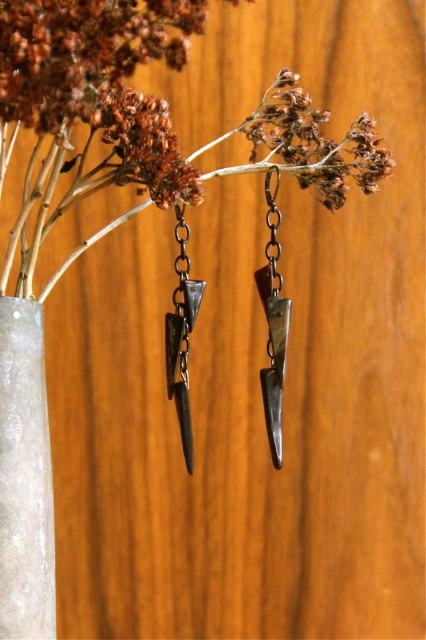
Find the location of `brown matte flower at upper center`. brown matte flower at upper center is located at coordinates (146, 145).

Is brown matte flower at upper center above matte silver earring at center?

Correct, brown matte flower at upper center is located above matte silver earring at center.

Is point (181, 198) in front of point (183, 236)?

That is True.

Find the location of a particular element. This screenshot has height=640, width=426. brown matte flower at upper center is located at coordinates (146, 145).

Does point (161, 157) come closer to viewer compared to point (275, 236)?

Yes.

Does brown matte flower at upper center have a larger size compared to matte silver spike at center?

Yes.

In order to click on brown matte flower at upper center in this screenshot , I will do `click(146, 145)`.

I want to click on clear glass vase at left, so click(x=25, y=477).

Is point (5, 598) closer to viewer compared to point (276, 456)?

Yes, point (5, 598) is closer to viewer.

Where is `clear glass vase at left`? This screenshot has height=640, width=426. clear glass vase at left is located at coordinates (25, 477).